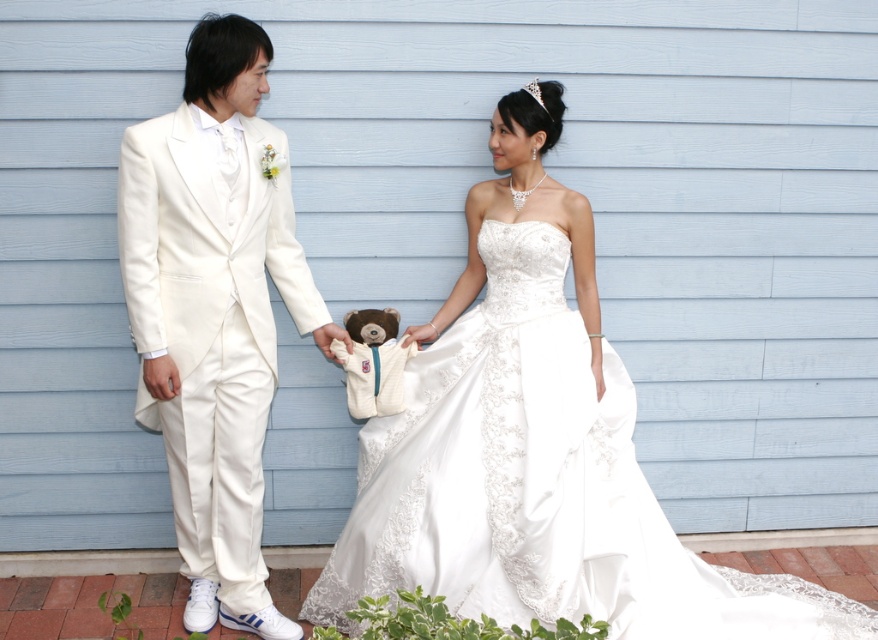
Is satin/embroidered dress at center to the right of white satin suit at left from the viewer's perspective?

Yes, satin/embroidered dress at center is to the right of white satin suit at left.

From the picture: Between satin/embroidered dress at center and white satin suit at left, which one is positioned higher?

Positioned higher is white satin suit at left.

Does point (620, 560) come closer to viewer compared to point (155, 186)?

No.

Find the location of `satin/embroidered dress at center`. satin/embroidered dress at center is located at coordinates (537, 484).